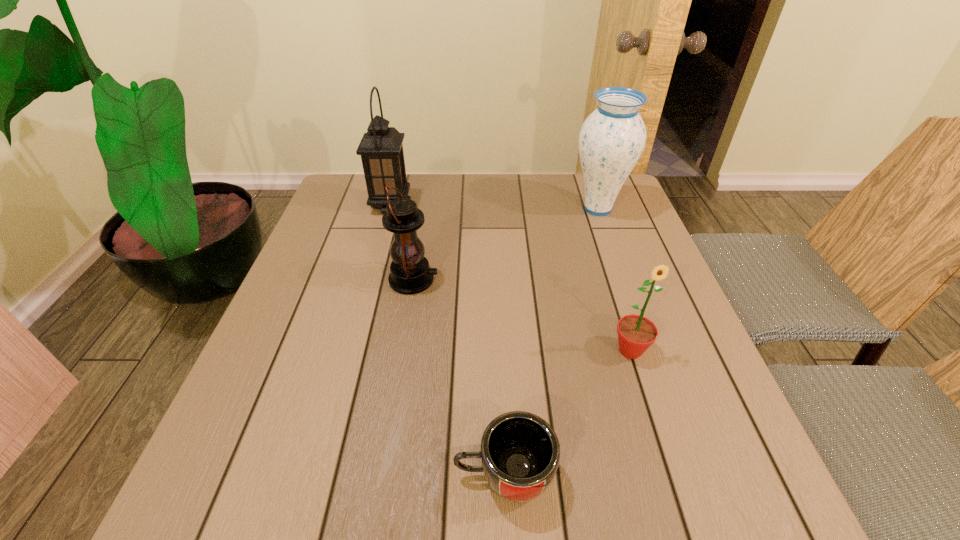
Identify the location of object located in the far left corner section of the desktop. This screenshot has height=540, width=960. pyautogui.click(x=381, y=149).

The height and width of the screenshot is (540, 960). Identify the location of object that is at the far right corner. (611, 141).

In the image, there is a desktop. Where is `vacant space at the far edge`? vacant space at the far edge is located at coordinates (478, 215).

In the image, there is a desktop. Find the location of `vacant space at the near edge`. vacant space at the near edge is located at coordinates (619, 480).

At what (x,y) coordinates should I click in order to perform the action: click on free space at the left edge of the desktop. Please return your answer as a coordinate pair (x, y). Image resolution: width=960 pixels, height=540 pixels. Looking at the image, I should click on (324, 326).

The width and height of the screenshot is (960, 540). Find the location of `vacant space at the right edge of the desktop`. vacant space at the right edge of the desktop is located at coordinates (682, 339).

In the image, there is a desktop. At what (x,y) coordinates should I click in order to perform the action: click on vacant space at the far left corner. Please return your answer as a coordinate pair (x, y). Looking at the image, I should click on (374, 210).

The height and width of the screenshot is (540, 960). What are the coordinates of `vacant space at the near right corner of the desktop` in the screenshot? It's located at (747, 509).

You are a GUI agent. You are given a task and a screenshot of the screen. Output one action in this format:
    pyautogui.click(x=<x>, y=<y>)
    Task: Click on the vacant area that lies between the shorter lantern and the nearest object
    
    Given the screenshot: What is the action you would take?
    pyautogui.click(x=459, y=377)

Identify the location of free spot between the sunflower and the taller lantern. (511, 278).